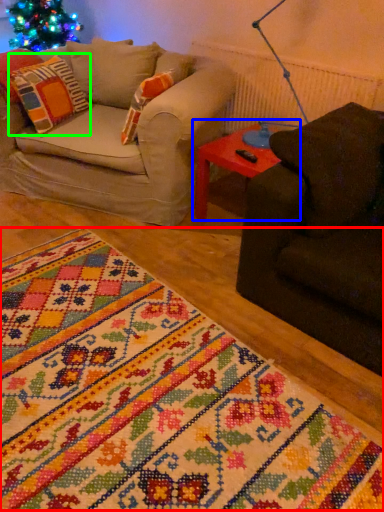
Question: Which is nearer to the blanket (highlighted by a red box)? table (highlighted by a blue box) or pillow (highlighted by a green box).

Choices:
 (A) table
 (B) pillow

Answer: (A)